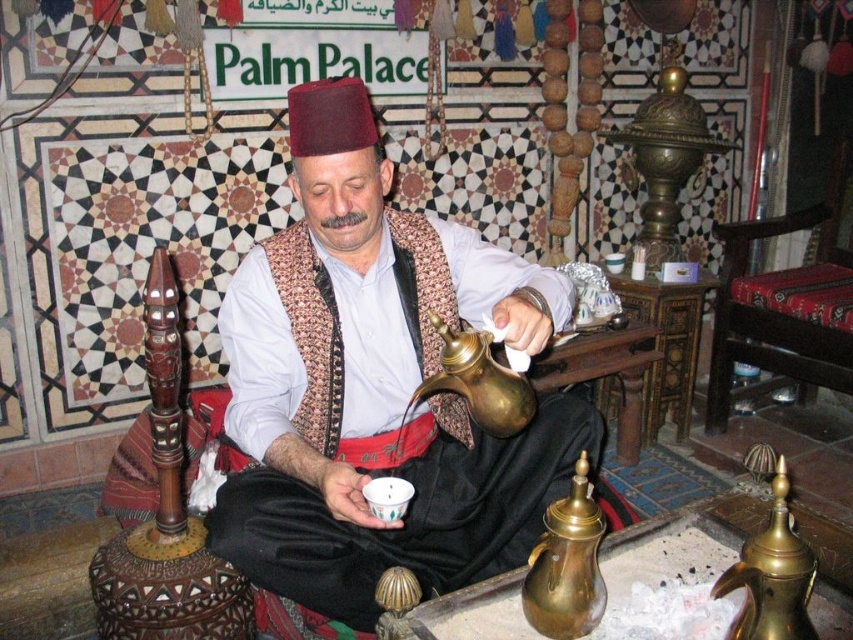
You are a customer at the Palm Palace and want to pour tea from the brass teapot at lower center into your cup. Which direction should you move to reach it from the brass teapot at center?

The brass teapot at lower center is to the right of the brass teapot at center, so you should move to the right to reach it.

You are a customer at the Palm Palace and want to choose a teapot to pour tea. You prefer a taller teapot. Which one should you choose between the brass teapot at lower center and the brass teapot at lower right?

The brass teapot at lower center is taller than the brass teapot at lower right, so you should choose the brass teapot at lower center.